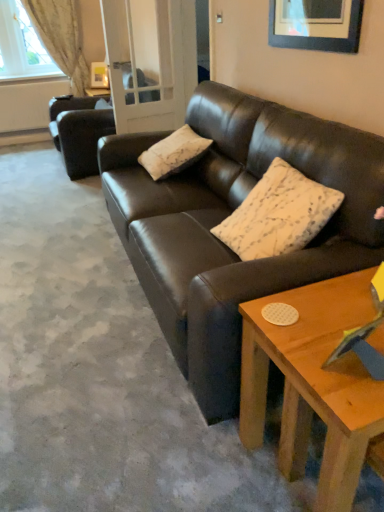
Question: Is white textured pillow at center, arranged as the second pillow when ordered from the bottom, turned away from clear glass door at center?

Choices:
 (A) no
 (B) yes

Answer: (A)

Question: Is white textured pillow at center, arranged as the second pillow when ordered from the bottom, oriented towards clear glass door at center?

Choices:
 (A) yes
 (B) no

Answer: (B)

Question: Does white textured pillow at center, which appears as the first pillow when viewed from the back, have a lesser height compared to clear glass door at center?

Choices:
 (A) yes
 (B) no

Answer: (A)

Question: Is white textured pillow at center, placed as the second pillow when sorted from right to left, at the right side of clear glass door at center?

Choices:
 (A) yes
 (B) no

Answer: (A)

Question: Considering the relative sizes of white textured pillow at center, which appears as the first pillow when viewed from the back, and clear glass door at center in the image provided, is white textured pillow at center, which appears as the first pillow when viewed from the back, thinner than clear glass door at center?

Choices:
 (A) no
 (B) yes

Answer: (A)

Question: Is point (178, 91) closer or farther from the camera than point (208, 315)?

Choices:
 (A) closer
 (B) farther

Answer: (B)

Question: Is clear glass door at center inside or outside of shiny brown leather couch at center, marked as the 2th studio couch in a back-to-front arrangement?

Choices:
 (A) inside
 (B) outside

Answer: (B)

Question: In terms of size, does clear glass door at center appear bigger or smaller than shiny brown leather couch at center, marked as the 2th studio couch in a back-to-front arrangement?

Choices:
 (A) small
 (B) big

Answer: (A)

Question: Is clear glass door at center wider or thinner than shiny brown leather couch at center, which is counted as the 1th studio couch, starting from the right?

Choices:
 (A) thin
 (B) wide

Answer: (A)

Question: From the image's perspective, is clear glass door at center above or below white textured pillow at center, the second pillow from the front?

Choices:
 (A) above
 (B) below

Answer: (A)

Question: Considering their positions, is clear glass door at center located in front of or behind white textured pillow at center, placed as the first pillow when sorted from left to right?

Choices:
 (A) behind
 (B) front

Answer: (A)

Question: In terms of height, does clear glass door at center look taller or shorter compared to white textured pillow at center, which appears as the first pillow when viewed from the back?

Choices:
 (A) short
 (B) tall

Answer: (B)

Question: Considering the relative positions of clear glass door at center and white textured pillow at center, the second pillow from the front, in the image provided, is clear glass door at center to the left or to the right of white textured pillow at center, the second pillow from the front,?

Choices:
 (A) right
 (B) left

Answer: (B)

Question: Which is correct: light beige fabric curtain at upper left is inside clear glass door at center, or outside of it?

Choices:
 (A) inside
 (B) outside

Answer: (B)

Question: Considering the positions of point (72, 56) and point (158, 59), is point (72, 56) closer or farther from the camera than point (158, 59)?

Choices:
 (A) farther
 (B) closer

Answer: (A)